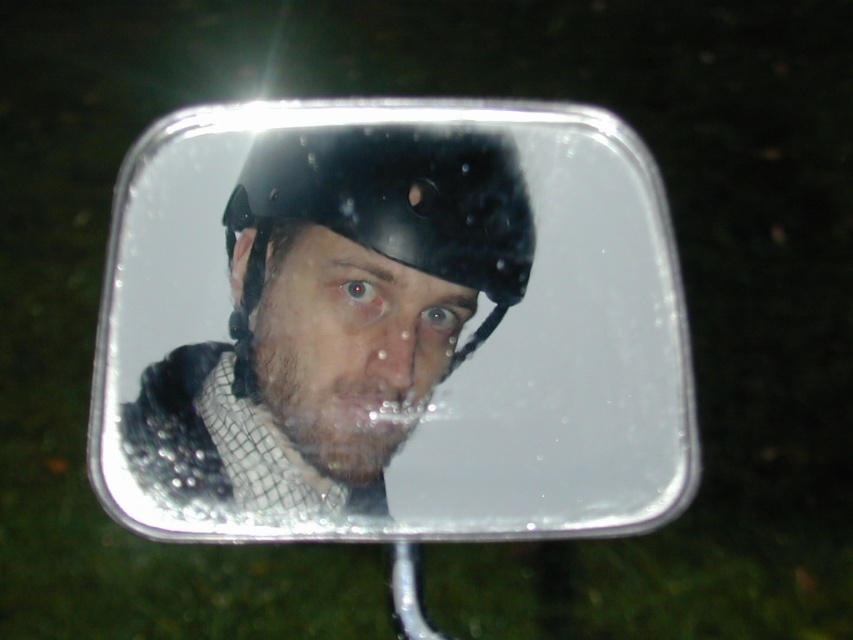
You are a driver checking your rearview mirror. You notice two points of light in the mirror. One is at point [381,147] and the other at [347,474]. Based on the mirror reflection, which point is closer to your vehicle?

Point [347,474] is closer to your vehicle because in a rearview mirror, objects that appear farther to the right or left are actually closer. Since point [381,147] is behind point [347,474] in the reflection, it means the latter is nearer to the vehicle.

You are a photographer adjusting the lighting in a dimly lit room. You notice two helmets, a matte black helmet at center and a shiny black helmet at center, reflected in a wet rearview mirror. Which helmet in the reflection appears more reflective due to the mirror and lighting conditions?

The shiny black helmet at center appears more reflective in the mirror due to its surface properties, making it stand out more under the dim lighting conditions.

You are a photographer adjusting lighting for a portrait. You notice two helmets in the frame, a matte black helmet at center and a shiny black helmet at center. Which helmet will reflect more light and require less direct lighting adjustment?

The shiny black helmet at center will reflect more light and require less direct lighting adjustment because it has a higher shine compared to the matte black helmet at center.